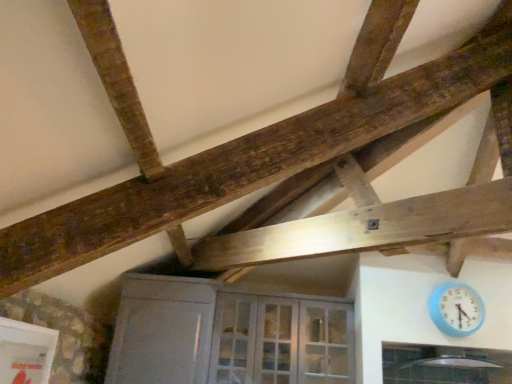
Question: From a real-world perspective, is clear glass window at lower center positioned over white glass door at center based on gravity?

Choices:
 (A) yes
 (B) no

Answer: (B)

Question: Is clear glass window at lower center aimed at white glass door at center?

Choices:
 (A) no
 (B) yes

Answer: (A)

Question: Does clear glass window at lower center have a lesser height compared to white glass door at center?

Choices:
 (A) no
 (B) yes

Answer: (B)

Question: From the image's perspective, would you say clear glass window at lower center is positioned over white glass door at center?

Choices:
 (A) yes
 (B) no

Answer: (B)

Question: Can you confirm if clear glass window at lower center is smaller than white glass door at center?

Choices:
 (A) no
 (B) yes

Answer: (B)

Question: Considering their positions, is clear glass window at lower center located in front of or behind white glass door at center?

Choices:
 (A) front
 (B) behind

Answer: (A)

Question: Based on their sizes in the image, would you say clear glass window at lower center is bigger or smaller than white glass door at center?

Choices:
 (A) small
 (B) big

Answer: (A)

Question: Does point (391, 347) appear closer or farther from the camera than point (264, 362)?

Choices:
 (A) farther
 (B) closer

Answer: (A)

Question: Considering the positions of clear glass window at lower center and white glass door at center in the image, is clear glass window at lower center taller or shorter than white glass door at center?

Choices:
 (A) tall
 (B) short

Answer: (B)

Question: Is point (266, 301) positioned closer to the camera than point (459, 302)?

Choices:
 (A) closer
 (B) farther

Answer: (B)

Question: Based on their positions, is white glass door at center located to the left or right of blue plastic wall clock at lower right?

Choices:
 (A) right
 (B) left

Answer: (B)

Question: Based on their sizes in the image, would you say white glass door at center is bigger or smaller than blue plastic wall clock at lower right?

Choices:
 (A) big
 (B) small

Answer: (A)

Question: Considering the positions of white glass door at center and blue plastic wall clock at lower right in the image, is white glass door at center wider or thinner than blue plastic wall clock at lower right?

Choices:
 (A) thin
 (B) wide

Answer: (B)

Question: Considering the positions of white glass door at center and clear glass window at lower center in the image, is white glass door at center wider or thinner than clear glass window at lower center?

Choices:
 (A) wide
 (B) thin

Answer: (B)

Question: From a real-world perspective, is white glass door at center positioned above or below clear glass window at lower center?

Choices:
 (A) below
 (B) above

Answer: (B)